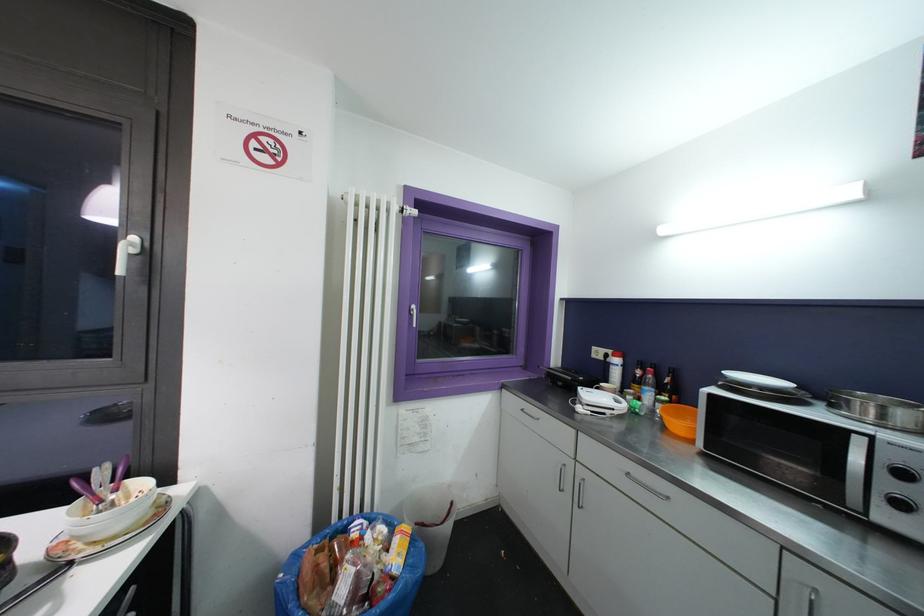
Find where to pull the white window handle. Please return your answer as a coordinate pair (x, y).

(412, 315)